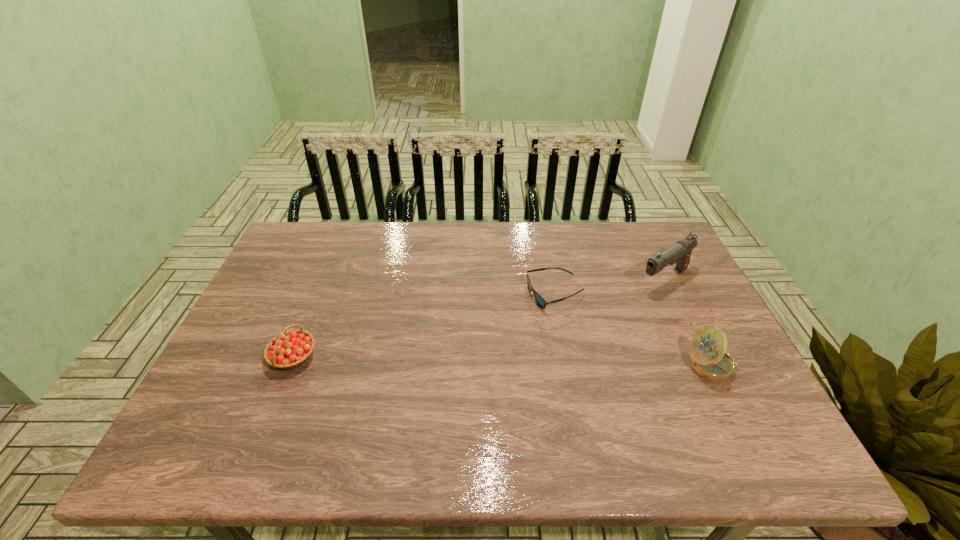
Image resolution: width=960 pixels, height=540 pixels. In order to click on vacant spot on the desktop that is between the strawberry and the third shortest object and is positioned in the direction the gun is aimed in this screenshot , I will do `click(538, 362)`.

Find the location of `free spot on the desktop that is between the leftmost object and the compass and is positioned at the front of the shortest object showing the lenses`. free spot on the desktop that is between the leftmost object and the compass and is positioned at the front of the shortest object showing the lenses is located at coordinates (494, 361).